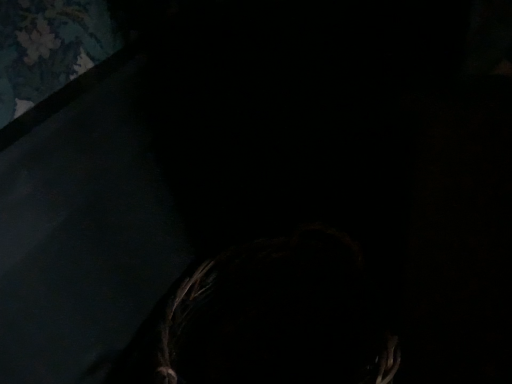
Locate an element on the screen. leather boot at lower center is located at coordinates (276, 318).

This screenshot has width=512, height=384. Describe the element at coordinates (276, 318) in the screenshot. I see `leather boot at lower center` at that location.

Where is `leather boot at lower center`? The image size is (512, 384). leather boot at lower center is located at coordinates (276, 318).